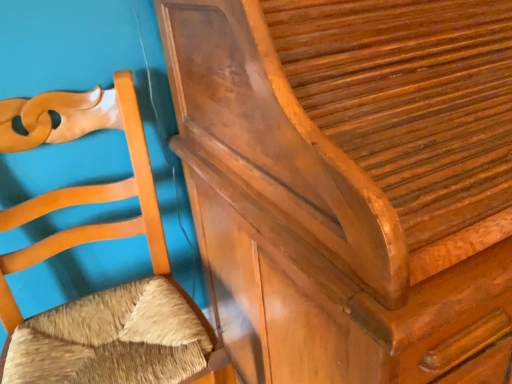
Question: From a real-world perspective, is matte wood chair at left, the 2th furniture positioned from the right, physically located above or below shiny brown wood dresser at upper right, which is counted as the 1th furniture, starting from the right?

Choices:
 (A) below
 (B) above

Answer: (A)

Question: Is matte wood chair at left, placed as the first furniture when sorted from left to right, to the left or to the right of shiny brown wood dresser at upper right, which is the 2th furniture in left-to-right order, in the image?

Choices:
 (A) left
 (B) right

Answer: (A)

Question: Is matte wood chair at left, placed as the first furniture when sorted from left to right, spatially inside shiny brown wood dresser at upper right, which is the 2th furniture in left-to-right order, or outside of it?

Choices:
 (A) inside
 (B) outside

Answer: (B)

Question: Is shiny brown wood dresser at upper right, which is counted as the 1th furniture, starting from the right, taller or shorter than matte wood chair at left, the 2th furniture positioned from the right?

Choices:
 (A) tall
 (B) short

Answer: (A)

Question: Looking at their shapes, would you say shiny brown wood dresser at upper right, which is counted as the 1th furniture, starting from the right, is wider or thinner than matte wood chair at left, placed as the first furniture when sorted from left to right?

Choices:
 (A) thin
 (B) wide

Answer: (B)

Question: Which is correct: shiny brown wood dresser at upper right, which is counted as the 1th furniture, starting from the right, is inside matte wood chair at left, placed as the first furniture when sorted from left to right, or outside of it?

Choices:
 (A) inside
 (B) outside

Answer: (B)

Question: Considering the relative positions of shiny brown wood dresser at upper right, which is the 2th furniture in left-to-right order, and matte wood chair at left, placed as the first furniture when sorted from left to right, in the image provided, is shiny brown wood dresser at upper right, which is the 2th furniture in left-to-right order, to the left or to the right of matte wood chair at left, placed as the first furniture when sorted from left to right,?

Choices:
 (A) right
 (B) left

Answer: (A)